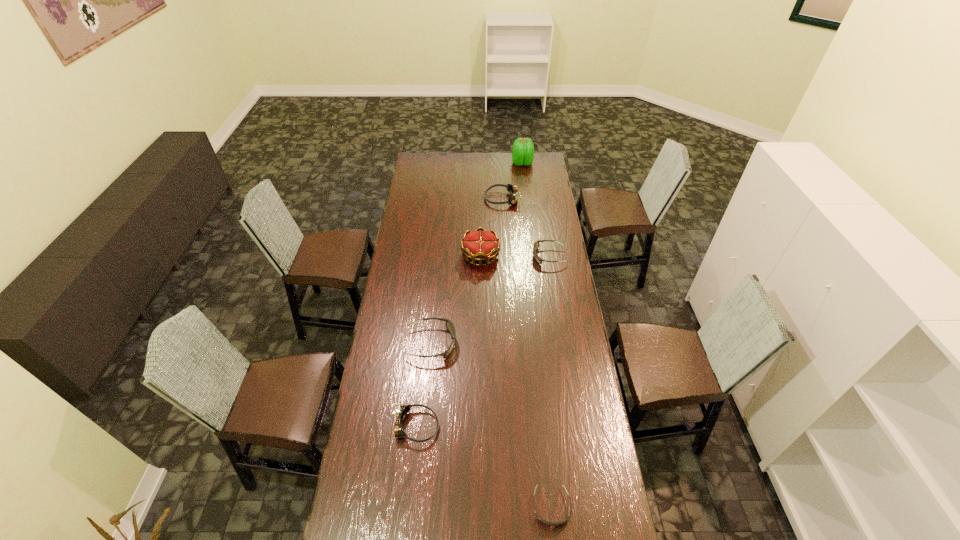
The height and width of the screenshot is (540, 960). In order to click on the second biggest black goggles in this screenshot , I will do `click(536, 245)`.

This screenshot has width=960, height=540. Identify the location of the farthest black goggles. (536, 245).

What are the coordinates of `the shortest object` in the screenshot? It's located at (542, 520).

Where is `the shortest goggles`? The height and width of the screenshot is (540, 960). the shortest goggles is located at coordinates (542, 520).

Identify the location of vacant space located 0.130m on the left of the bell pepper. (492, 163).

The width and height of the screenshot is (960, 540). I want to click on vacant space situated on the front of the gold crown, so click(x=481, y=290).

The width and height of the screenshot is (960, 540). I want to click on free space located 0.360m through the lenses of the right bronze goggles, so coord(422,199).

This screenshot has width=960, height=540. Find the location of `free region located 0.060m through the lenses of the right bronze goggles`. free region located 0.060m through the lenses of the right bronze goggles is located at coordinates (474, 199).

At what (x,y) coordinates should I click in order to perform the action: click on vacant space located 0.090m through the lenses of the right bronze goggles. Please return your answer as a coordinate pair (x, y). The height and width of the screenshot is (540, 960). Looking at the image, I should click on (468, 199).

Where is `vacant position located 0.070m on the lenses of the biggest black goggles`? The width and height of the screenshot is (960, 540). vacant position located 0.070m on the lenses of the biggest black goggles is located at coordinates (473, 343).